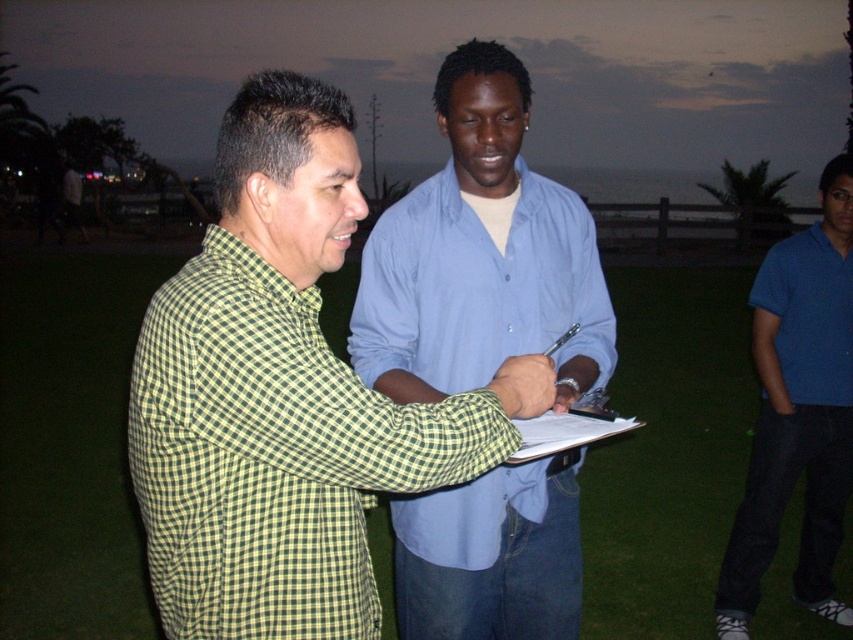
You are a photographer trying to capture both the green checkered shirt at center and the blue cotton shirt at center in a single frame. Given that your camera can only focus on objects within a 10 cm depth range, and knowing their thickness, will you be able to capture both clearly?

The green checkered shirt at center is thinner than the blue cotton shirt at center. Since the camera can focus on objects within a 10 cm depth range, and the difference in their thickness is within that range, both shirts can be captured clearly in the same frame.

You are a photographer who needs to capture a clear shot of the white paper at center and the blue cotton polo shirt at right. Based on their positions, which object should you focus on first to ensure both are in frame?

The blue cotton polo shirt at right is located above the white paper at center, so focusing on the blue cotton polo shirt at right first will help ensure both are in frame as the white paper at center is below it.